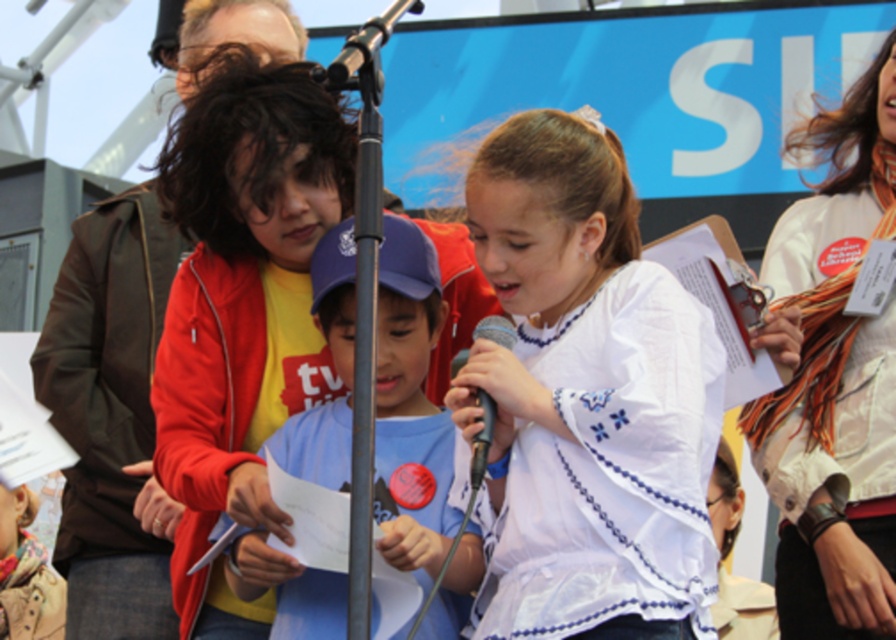
Measure the distance between white embroidered blouse at center and white scarf at upper right.

A distance of 7.75 meters exists between white embroidered blouse at center and white scarf at upper right.

From the picture: Between white embroidered blouse at center and white scarf at upper right, which one appears on the right side from the viewer's perspective?

From the viewer's perspective, white scarf at upper right appears more on the right side.

The width and height of the screenshot is (896, 640). I want to click on white embroidered blouse at center, so click(587, 397).

Can you confirm if white scarf at upper right is bigger than black plastic microphone at center?

Yes, white scarf at upper right is bigger than black plastic microphone at center.

Which is below, white scarf at upper right or black plastic microphone at center?

black plastic microphone at center

Is point (866, 449) positioned before point (477, 332)?

No, (866, 449) is behind (477, 332).

This screenshot has height=640, width=896. In order to click on white scarf at upper right in this screenshot , I will do `click(834, 380)`.

Who is lower down, white embroidered blouse at center or blue cotton shirt at center?

Positioned lower is blue cotton shirt at center.

Who is more forward, (487, 195) or (448, 476)?

Point (487, 195)

You are a GUI agent. You are given a task and a screenshot of the screen. Output one action in this format:
    pyautogui.click(x=<x>, y=<y>)
    Task: Click on the white embroidered blouse at center
    The height and width of the screenshot is (640, 896).
    Given the screenshot: What is the action you would take?
    pyautogui.click(x=587, y=397)